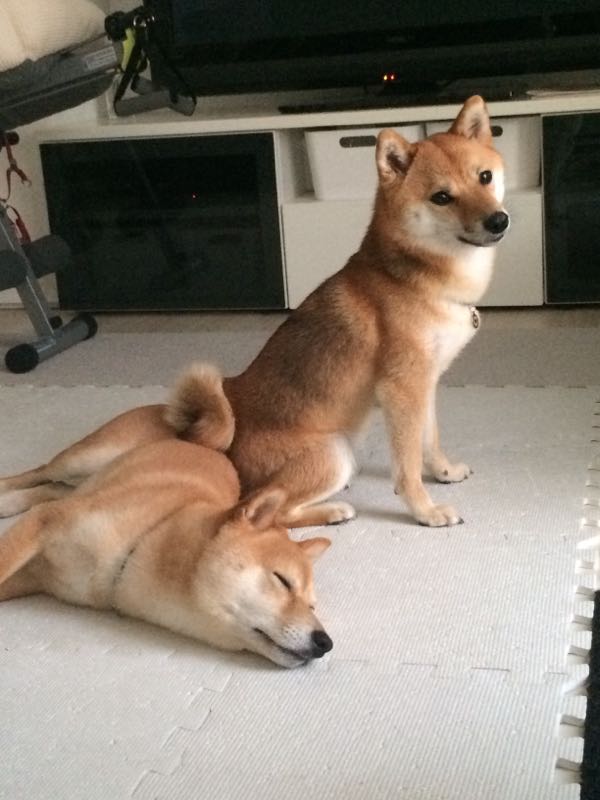
Where is `floor`? The image size is (600, 800). floor is located at coordinates (111, 380), (434, 673).